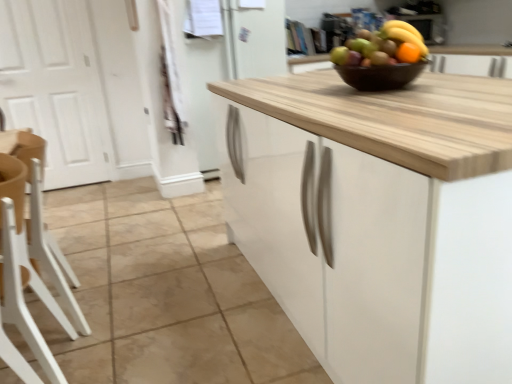
Where is `vacant space behind white plastic chair at lower left, the 1th chair in the front-to-back sequence`? Image resolution: width=512 pixels, height=384 pixels. vacant space behind white plastic chair at lower left, the 1th chair in the front-to-back sequence is located at coordinates (111, 322).